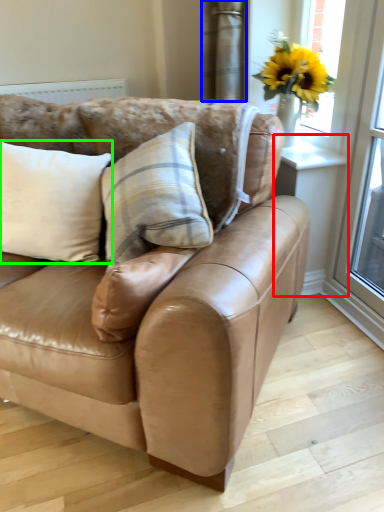
Question: Considering the real-world distances, which object is farthest from window (highlighted by a red box)? curtain (highlighted by a blue box) or pillow (highlighted by a green box)?

Choices:
 (A) curtain
 (B) pillow

Answer: (B)